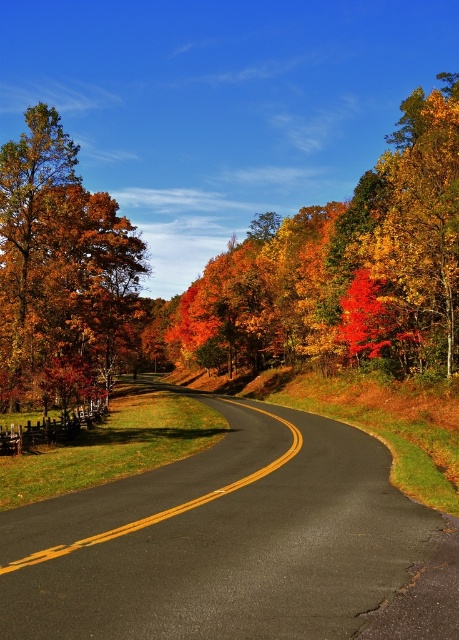
Does orange autumn leaves at left have a smaller size compared to bright red leaves at center?

Actually, orange autumn leaves at left might be larger than bright red leaves at center.

Based on the photo, who is higher up, orange autumn leaves at left or bright red leaves at center?

orange autumn leaves at left is higher up.

Find the location of a particular element. This screenshot has width=459, height=640. orange autumn leaves at left is located at coordinates (60, 269).